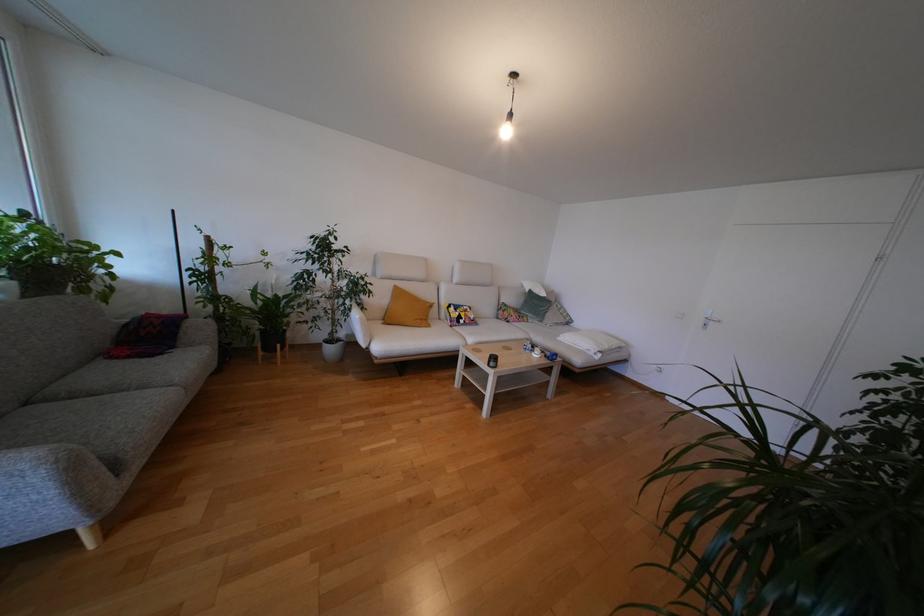
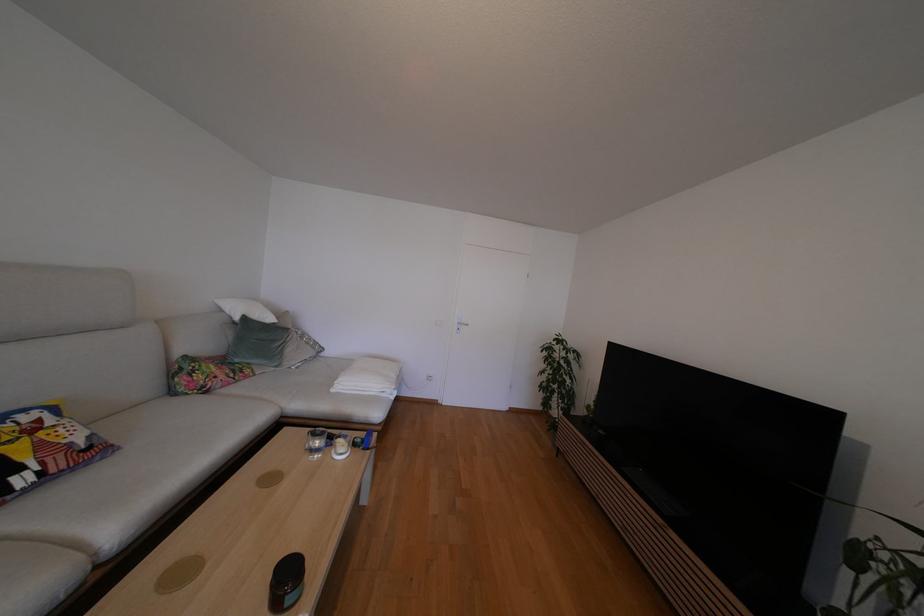
In the second image, find the point that corresponds to the point at 527,314 in the first image.

(241, 363)